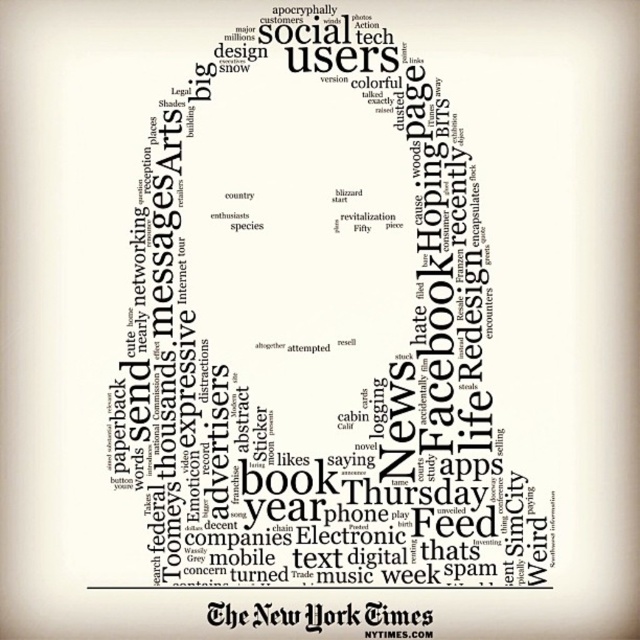
You are an artist trying to place a new red sticker in the scene. The sticker is small and needs to be placed either on the white paper at center or the black paper at bottom. Which paper can you place the sticker on without it being hidden by another object?

The black paper at bottom is behind the white paper at center, so placing the sticker on the white paper at center will keep it visible. Therefore, you should place the sticker on the white paper at center.

You are an artist who wants to place a new element in the word cloud. The current word cloud has a white paper at center located at point (316,326). Where should you place the new element to ensure it is directly above the white paper at center?

To place the new element directly above the white paper at center at point (316,326), you should position it at a point with the same x coordinate of 0.511 and a y coordinate slightly less than 0.495, since in coordinate systems, decreasing the y value moves the position upward.

You have two pieces of paper in front of you, a white paper at center and a black paper at bottom. Which one is bigger?

The white paper at center is larger in size than the black paper at bottom.